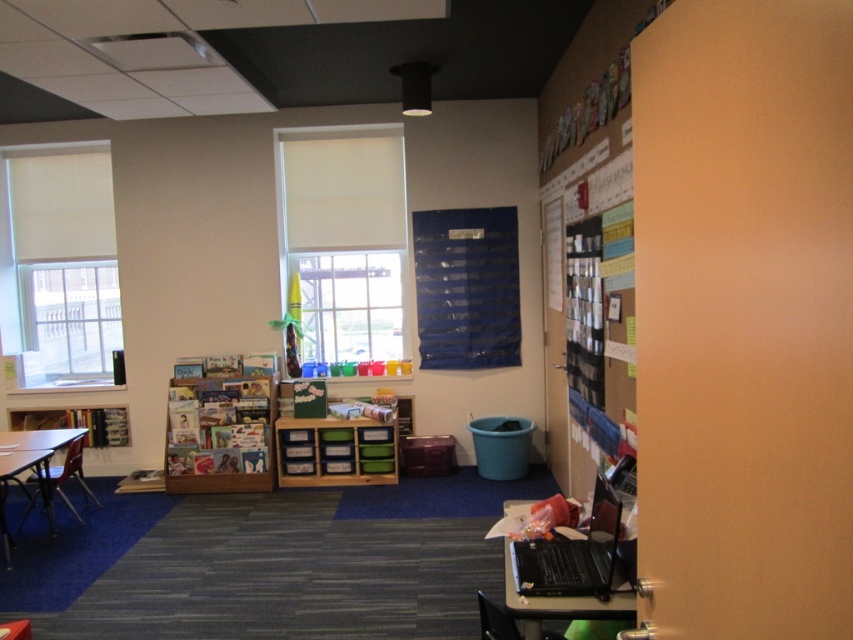
Can you confirm if cardboard bulletin board at right is bigger than black plastic computer desk at lower right?

Yes.

Does cardboard bulletin board at right have a smaller size compared to black plastic computer desk at lower right?

Incorrect, cardboard bulletin board at right is not smaller in size than black plastic computer desk at lower right.

The width and height of the screenshot is (853, 640). Find the location of `cardboard bulletin board at right`. cardboard bulletin board at right is located at coordinates (589, 305).

Is point (582, 195) less distant than point (219, 426)?

Yes, it is.

Looking at this image, is cardboard bulletin board at right to the left of wooden bookshelf at center from the viewer's perspective?

No, cardboard bulletin board at right is not to the left of wooden bookshelf at center.

Describe the element at coordinates (589, 305) in the screenshot. Image resolution: width=853 pixels, height=640 pixels. I see `cardboard bulletin board at right` at that location.

You are a GUI agent. You are given a task and a screenshot of the screen. Output one action in this format:
    pyautogui.click(x=<x>, y=<y>)
    Task: Click on the cardboard bulletin board at right
    
    Given the screenshot: What is the action you would take?
    pyautogui.click(x=589, y=305)

Which of these two, cardboard bulletin board at right or black plastic laptop at right, stands shorter?

black plastic laptop at right

Who is more distant from viewer, (625, 198) or (561, 547)?

Positioned behind is point (625, 198).

What are the coordinates of `cardboard bulletin board at right` in the screenshot? It's located at (589, 305).